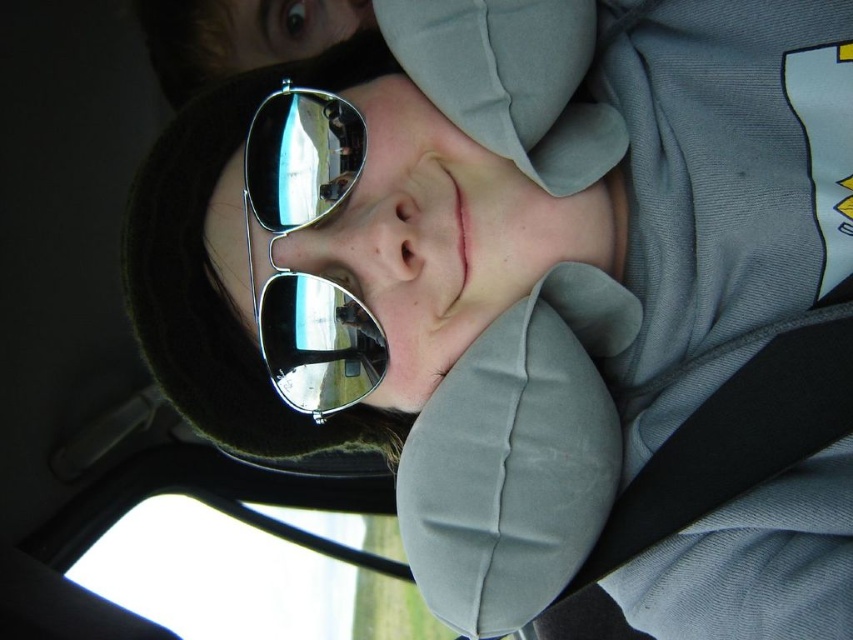
Question: Does transparent glass car window at lower left have a lesser width compared to metallic reflective sunglasses at center?

Choices:
 (A) no
 (B) yes

Answer: (A)

Question: Can you confirm if transparent glass car window at lower left is positioned above metallic reflective sunglasses at center?

Choices:
 (A) no
 (B) yes

Answer: (A)

Question: From the image, what is the correct spatial relationship of transparent glass car window at lower left in relation to metallic reflective sunglasses at center?

Choices:
 (A) right
 (B) left

Answer: (B)

Question: Which point is closer to the camera taking this photo?

Choices:
 (A) (271, 102)
 (B) (164, 552)

Answer: (A)

Question: Which point appears farthest from the camera in this image?

Choices:
 (A) (341, 566)
 (B) (276, 136)

Answer: (A)